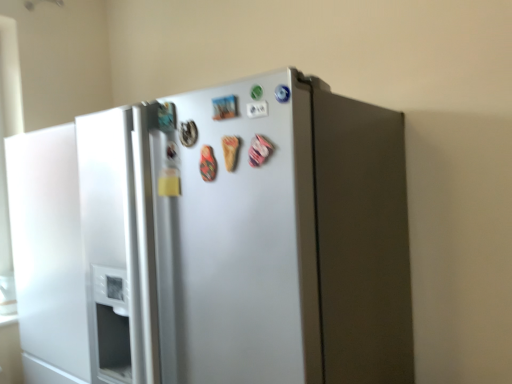
Question: In terms of width, does satin silver refrigerator at center look wider or thinner when compared to white matte refrigerator door at left?

Choices:
 (A) wide
 (B) thin

Answer: (A)

Question: Do you think satin silver refrigerator at center is within white matte refrigerator door at left, or outside of it?

Choices:
 (A) inside
 (B) outside

Answer: (B)

Question: Does point (368, 137) appear closer or farther from the camera than point (81, 302)?

Choices:
 (A) farther
 (B) closer

Answer: (B)

Question: Would you say white matte refrigerator door at left is to the left or to the right of satin silver refrigerator at center in the picture?

Choices:
 (A) right
 (B) left

Answer: (B)

Question: Is white matte refrigerator door at left situated inside satin silver refrigerator at center or outside?

Choices:
 (A) outside
 (B) inside

Answer: (A)

Question: Based on their sizes in the image, would you say white matte refrigerator door at left is bigger or smaller than satin silver refrigerator at center?

Choices:
 (A) small
 (B) big

Answer: (A)

Question: Looking at their shapes, would you say white matte refrigerator door at left is wider or thinner than satin silver refrigerator at center?

Choices:
 (A) wide
 (B) thin

Answer: (B)